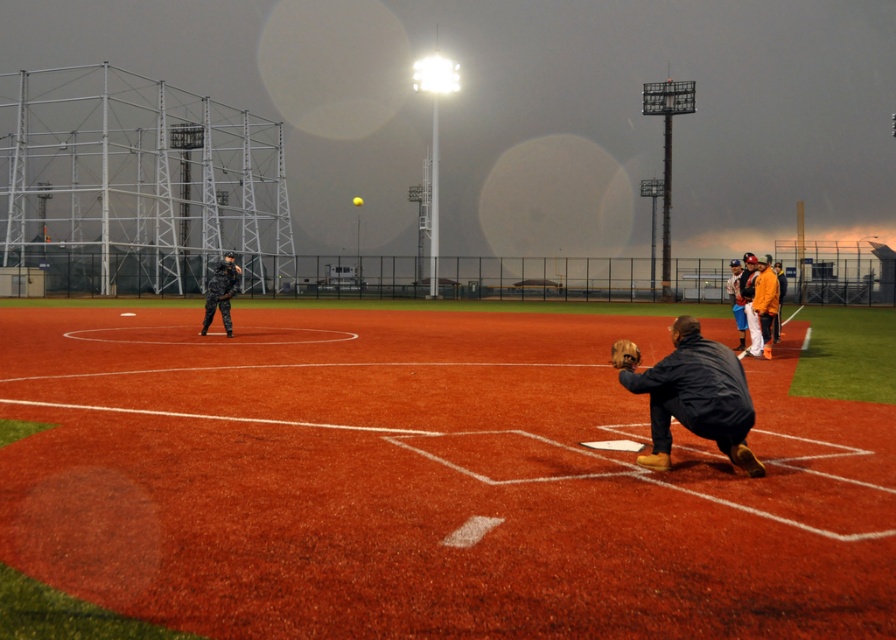
Is rubberized orange turf at center thinner than brown leather baseball glove at lower center?

In fact, rubberized orange turf at center might be wider than brown leather baseball glove at lower center.

In order to click on rubberized orange turf at center in this screenshot , I will do 426,481.

Describe the element at coordinates (426, 481) in the screenshot. I see `rubberized orange turf at center` at that location.

Identify the location of rubberized orange turf at center. (426, 481).

Is point (563, 616) behind point (738, 362)?

No, (563, 616) is in front of (738, 362).

Does rubberized orange turf at center appear over dark blue jacket at lower right?

Actually, rubberized orange turf at center is below dark blue jacket at lower right.

Which is behind, point (311, 483) or point (622, 381)?

The point (622, 381) is more distant.

This screenshot has width=896, height=640. Find the location of `rubberized orange turf at center`. rubberized orange turf at center is located at coordinates (426, 481).

Which is behind, point (226, 330) or point (629, 348)?

Positioned behind is point (226, 330).

Who is positioned more to the right, camouflage uniform at center or brown leather baseball glove at lower center?

Positioned to the right is brown leather baseball glove at lower center.

Between point (225, 300) and point (616, 342), which one is positioned behind?

Point (225, 300)

Where is `camouflage uniform at center`? camouflage uniform at center is located at coordinates (221, 292).